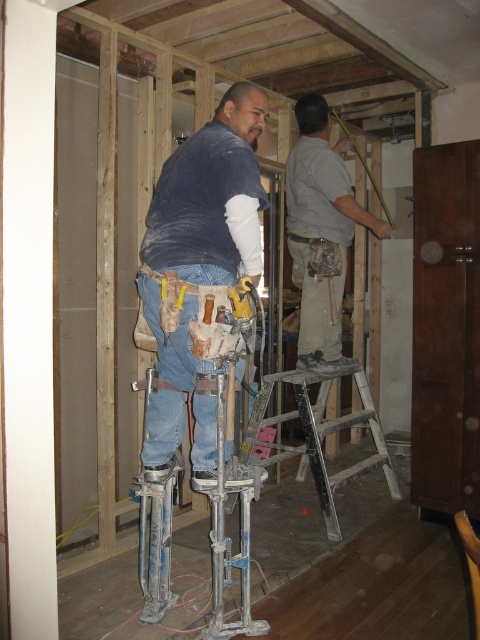
Question: Which object is positioned farthest from the blue denim jeans at center?

Choices:
 (A) yellow plastic hammer at center
 (B) gray fabric shirt at upper center

Answer: (B)

Question: Can you confirm if gray fabric shirt at upper center is smaller than metallic silver ladder at center?

Choices:
 (A) no
 (B) yes

Answer: (B)

Question: Which object is closer to the camera taking this photo?

Choices:
 (A) metallic silver ladder at center
 (B) gray fabric shirt at upper center
 (C) blue denim jeans at center

Answer: (C)

Question: Which object is positioned farthest from the metallic silver ladder at center?

Choices:
 (A) yellow plastic hammer at center
 (B) blue denim jeans at center

Answer: (A)

Question: Can you confirm if blue denim jeans at center is positioned below metallic silver ladder at center?

Choices:
 (A) yes
 (B) no

Answer: (B)

Question: Does gray fabric shirt at upper center appear under yellow plastic hammer at center?

Choices:
 (A) no
 (B) yes

Answer: (A)